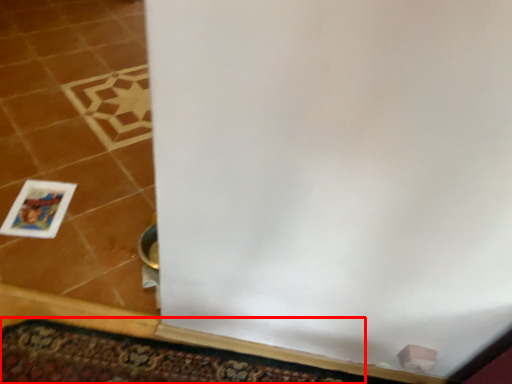
Question: From the image, what is the correct spatial relationship of doormat (annotated by the red box) in relation to picture frame?

Choices:
 (A) left
 (B) right

Answer: (B)